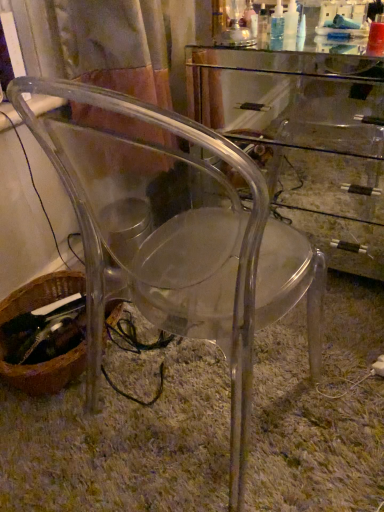
What are the coordinates of `transparent acrylic computer desk at center` in the screenshot? It's located at (308, 136).

What do you see at coordinates (181, 246) in the screenshot?
I see `transparent acrylic chair at center` at bounding box center [181, 246].

Identify the location of brown woven basket at lower left. (45, 372).

Where is `transparent acrylic computer desk at center`? transparent acrylic computer desk at center is located at coordinates click(308, 136).

Is transparent acrylic chair at center oriented towards transparent acrylic computer desk at center?

Yes, transparent acrylic chair at center is aimed at transparent acrylic computer desk at center.

Is transparent acrylic chair at center inside or outside of transparent acrylic computer desk at center?

transparent acrylic chair at center is outside transparent acrylic computer desk at center.

From a real-world perspective, which object rests below the other?

transparent acrylic computer desk at center, from a real-world perspective.

Between brown woven basket at lower left and transparent acrylic chair at center, which one has more height?

Standing taller between the two is transparent acrylic chair at center.

Based on the photo, is transparent acrylic chair at center at the back of brown woven basket at lower left?

No, brown woven basket at lower left is not facing the opposite direction of transparent acrylic chair at center.

Is brown woven basket at lower left spatially inside transparent acrylic chair at center, or outside of it?

brown woven basket at lower left is outside transparent acrylic chair at center.

In the scene shown: Does transparent acrylic chair at center touch brown woven basket at lower left?

transparent acrylic chair at center and brown woven basket at lower left are not in contact.

Would you say brown woven basket at lower left is part of transparent acrylic chair at center's contents?

No, brown woven basket at lower left is not a part of transparent acrylic chair at center.

From a real-world perspective, which is physically above, transparent acrylic chair at center or brown woven basket at lower left?

In real-world perspective, transparent acrylic chair at center is above.

Considering the sizes of objects brown woven basket at lower left and transparent acrylic computer desk at center in the image provided, who is taller, brown woven basket at lower left or transparent acrylic computer desk at center?

Standing taller between the two is transparent acrylic computer desk at center.

In the scene shown: From a real-world perspective, is brown woven basket at lower left above or below transparent acrylic computer desk at center?

From a real-world perspective, brown woven basket at lower left is physically below transparent acrylic computer desk at center.

Is brown woven basket at lower left facing away from transparent acrylic computer desk at center?

No, transparent acrylic computer desk at center is not at the back of brown woven basket at lower left.

Which object is further away from the camera, brown woven basket at lower left or transparent acrylic computer desk at center?

Positioned behind is brown woven basket at lower left.

Considering the relative sizes of transparent acrylic computer desk at center and brown woven basket at lower left in the image provided, is transparent acrylic computer desk at center smaller than brown woven basket at lower left?

No.

Between transparent acrylic computer desk at center and brown woven basket at lower left, which one has smaller width?

With smaller width is brown woven basket at lower left.

Would you say transparent acrylic computer desk at center is a long distance from brown woven basket at lower left?

That's right, there is a large distance between transparent acrylic computer desk at center and brown woven basket at lower left.

From the image's perspective, is transparent acrylic computer desk at center located above brown woven basket at lower left?

Yes, from the image's perspective, transparent acrylic computer desk at center is over brown woven basket at lower left.

In the image, is transparent acrylic computer desk at center on the left side or the right side of transparent acrylic chair at center?

Clearly, transparent acrylic computer desk at center is on the right of transparent acrylic chair at center in the image.

Considering the sizes of objects transparent acrylic computer desk at center and transparent acrylic chair at center in the image provided, who is bigger, transparent acrylic computer desk at center or transparent acrylic chair at center?

Bigger between the two is transparent acrylic computer desk at center.

How different are the orientations of transparent acrylic computer desk at center and transparent acrylic chair at center in degrees?

transparent acrylic computer desk at center and transparent acrylic chair at center are facing 173 degrees away from each other.

Locate an element on the screen. chair located on the left of transparent acrylic computer desk at center is located at coordinates (181, 246).

Locate an element on the screen. The image size is (384, 512). chair located above the brown woven basket at lower left (from the image's perspective) is located at coordinates (181, 246).

Considering their positions, is brown woven basket at lower left positioned further to transparent acrylic chair at center than transparent acrylic computer desk at center?

Among the two, transparent acrylic computer desk at center is located further to transparent acrylic chair at center.

From the image, which object appears to be farther from brown woven basket at lower left, transparent acrylic computer desk at center or transparent acrylic chair at center?

transparent acrylic computer desk at center.

Looking at the image, which one is located closer to transparent acrylic chair at center, transparent acrylic computer desk at center or brown woven basket at lower left?

Based on the image, brown woven basket at lower left appears to be nearer to transparent acrylic chair at center.

Based on their spatial positions, is transparent acrylic chair at center or brown woven basket at lower left further from transparent acrylic computer desk at center?

Among the two, brown woven basket at lower left is located further to transparent acrylic computer desk at center.

When comparing their distances from transparent acrylic computer desk at center, does brown woven basket at lower left or transparent acrylic chair at center seem closer?

Based on the image, transparent acrylic chair at center appears to be nearer to transparent acrylic computer desk at center.

Looking at this image, which object lies further to the anchor point brown woven basket at lower left, transparent acrylic chair at center or transparent acrylic computer desk at center?

transparent acrylic computer desk at center is further to brown woven basket at lower left.

Locate an element on the screen. The image size is (384, 512). chair between brown woven basket at lower left and transparent acrylic computer desk at center from left to right is located at coordinates 181,246.